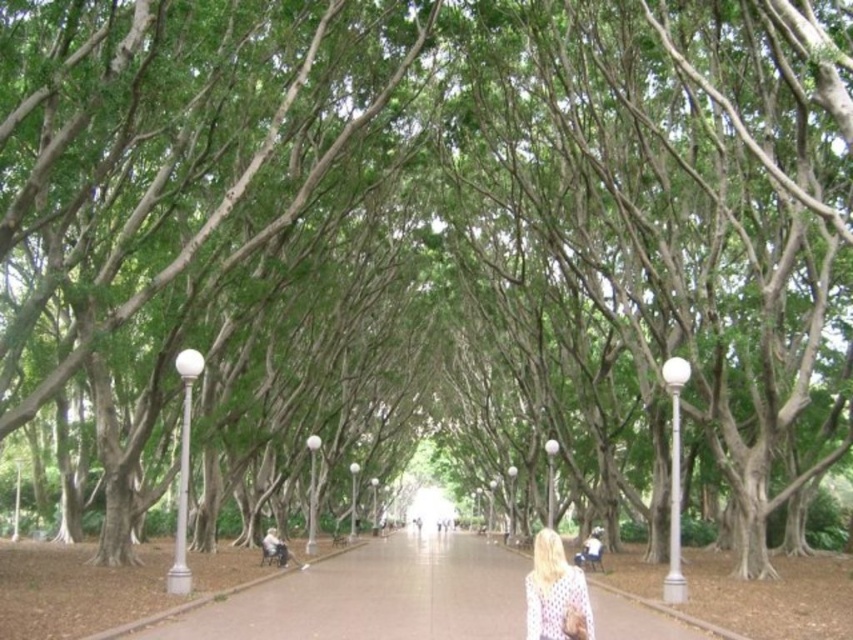
Question: Is smooth concrete path at center to the right of white dotted sweater at center from the viewer's perspective?

Choices:
 (A) no
 (B) yes

Answer: (A)

Question: Which of the following is the farthest from the observer?

Choices:
 (A) white dotted sweater at center
 (B) smooth concrete path at center

Answer: (B)

Question: Does smooth concrete path at center have a larger size compared to white dotted sweater at center?

Choices:
 (A) yes
 (B) no

Answer: (A)

Question: Which object is closer to the camera taking this photo?

Choices:
 (A) smooth concrete path at center
 (B) white dotted sweater at center

Answer: (B)

Question: Can you confirm if smooth concrete path at center is thinner than white dotted sweater at center?

Choices:
 (A) yes
 (B) no

Answer: (B)